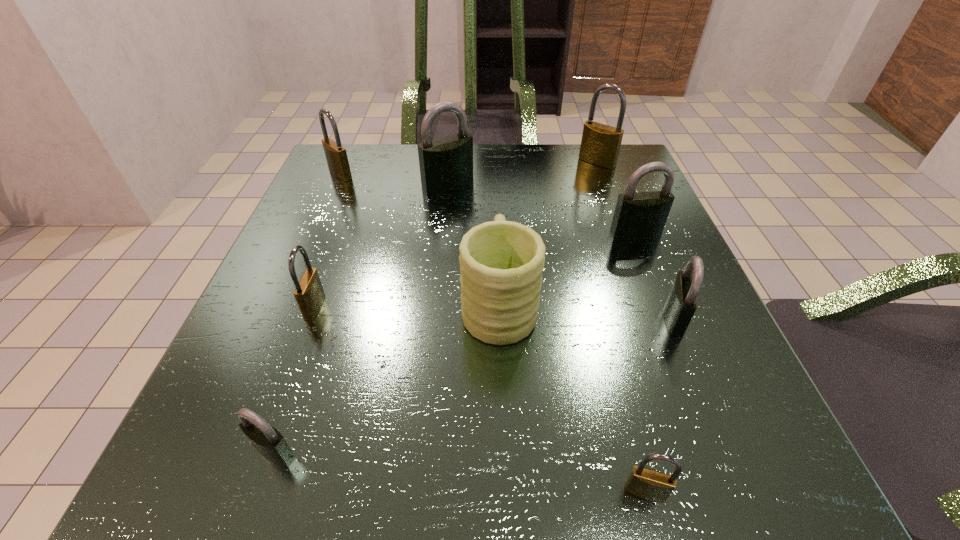
This screenshot has width=960, height=540. I want to click on black padlock that is the second closest one to the leftmost padlock, so click(x=641, y=215).

Identify the location of black padlock object that ranks as the second closest to the fifth nearest padlock. This screenshot has width=960, height=540. (445, 163).

This screenshot has height=540, width=960. In order to click on vacant space that satisfies the following two spatial constraints: 1. on the back side of the third biggest brass padlock; 2. on the left side of the second black padlock from left to right in this screenshot , I will do point(360,183).

Image resolution: width=960 pixels, height=540 pixels. What are the coordinates of `blank area in the image that satisfies the following two spatial constraints: 1. on the back side of the third farthest brass padlock; 2. on the left side of the farthest black padlock` in the screenshot? It's located at (360, 183).

Where is `vacant area that satisfies the following two spatial constraints: 1. on the back side of the fourth object from right to left; 2. on the left side of the third nearest black padlock`? The height and width of the screenshot is (540, 960). vacant area that satisfies the following two spatial constraints: 1. on the back side of the fourth object from right to left; 2. on the left side of the third nearest black padlock is located at coordinates (x=578, y=233).